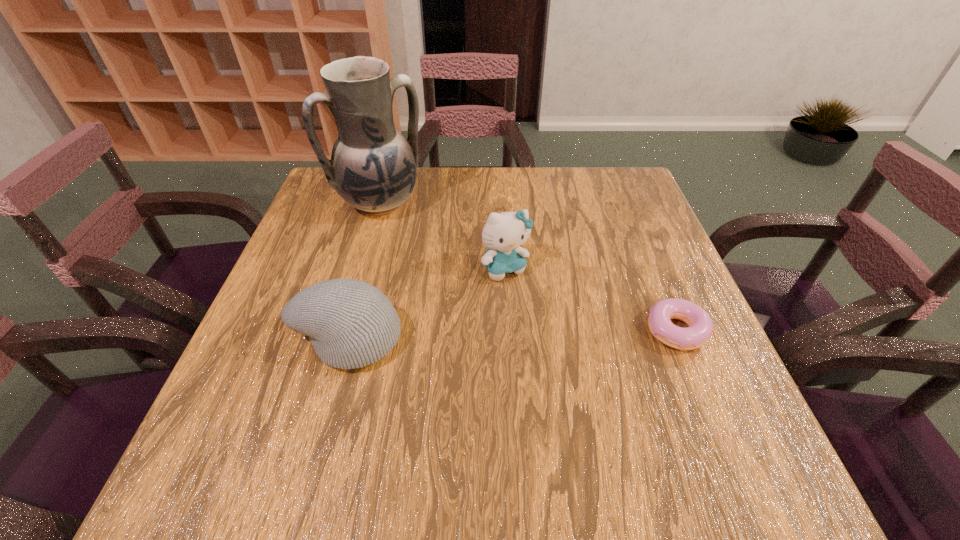
Where is `free space at the far edge of the desktop`? This screenshot has height=540, width=960. free space at the far edge of the desktop is located at coordinates (512, 174).

Locate an element on the screen. free space at the left edge of the desktop is located at coordinates (271, 380).

Where is `vacant space at the right edge of the desktop`? This screenshot has height=540, width=960. vacant space at the right edge of the desktop is located at coordinates (657, 237).

Where is `vacant space at the far left corner of the desktop`? The height and width of the screenshot is (540, 960). vacant space at the far left corner of the desktop is located at coordinates (311, 213).

This screenshot has height=540, width=960. Find the location of `vacant space at the near left corner`. vacant space at the near left corner is located at coordinates (279, 386).

You are a GUI agent. You are given a task and a screenshot of the screen. Output one action in this format:
    pyautogui.click(x=<x>, y=<y>)
    Task: Click on the free space at the far right corner of the desktop
    The height and width of the screenshot is (540, 960).
    Given the screenshot: What is the action you would take?
    pyautogui.click(x=598, y=210)

The image size is (960, 540). I want to click on vacant space in between the doughnut and the beanie, so click(x=512, y=334).

Find the location of `free spot between the pitcher and the shortest object`. free spot between the pitcher and the shortest object is located at coordinates (528, 267).

The image size is (960, 540). Find the location of `free spot between the pitcher and the beanie`. free spot between the pitcher and the beanie is located at coordinates (364, 271).

This screenshot has width=960, height=540. Find the location of `free spot between the second shortest object and the doughnut`. free spot between the second shortest object and the doughnut is located at coordinates (512, 334).